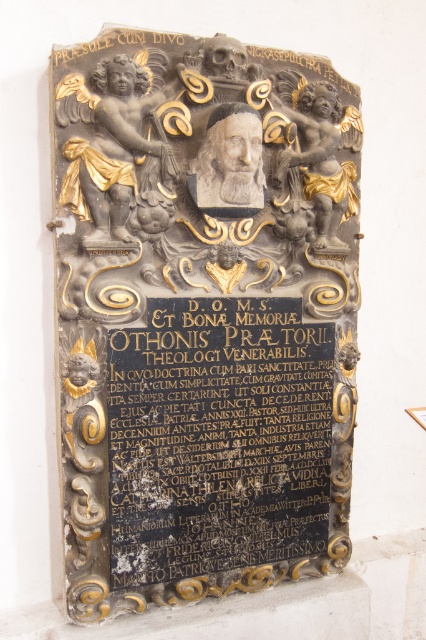
Measure the distance from matte stone plaque at center to gray stone bust at center.

10.01 inches

Looking at this image, is matte stone plaque at center to the left of gray stone bust at center from the viewer's perspective?

Indeed, matte stone plaque at center is positioned on the left side of gray stone bust at center.

Where is `matte stone plaque at center`? The height and width of the screenshot is (640, 426). matte stone plaque at center is located at coordinates (201, 323).

Image resolution: width=426 pixels, height=640 pixels. Find the location of `black polished stone plaque at center`. black polished stone plaque at center is located at coordinates (218, 436).

Does point (236, 529) come in front of point (111, 211)?

No, it is not.

Between point (146, 372) and point (135, 109), which one is positioned behind?

The point (146, 372) is behind.

Find the location of a particular element. The width and height of the screenshot is (426, 640). black polished stone plaque at center is located at coordinates (218, 436).

Does gold/gilded cherub at upper right have a smaller size compared to gray stone bust at center?

Actually, gold/gilded cherub at upper right might be larger than gray stone bust at center.

Can you confirm if gold/gilded cherub at upper right is wider than gray stone bust at center?

Yes, gold/gilded cherub at upper right is wider than gray stone bust at center.

I want to click on gold/gilded cherub at upper right, so click(x=321, y=154).

I want to click on gold/gilded cherub at upper right, so click(321, 154).